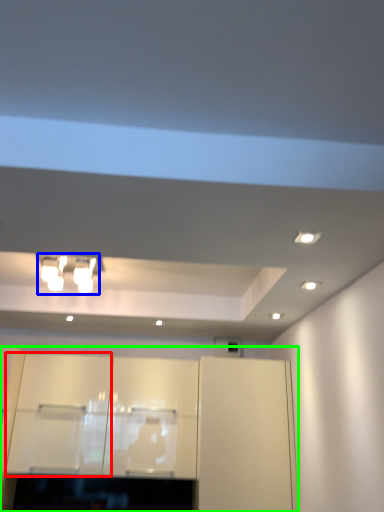
Question: Which object is positioned farthest from cabinetry (highlighted by a red box)? Select from light fixture (highlighted by a blue box) and cabinetry (highlighted by a green box).

Choices:
 (A) light fixture
 (B) cabinetry

Answer: (A)